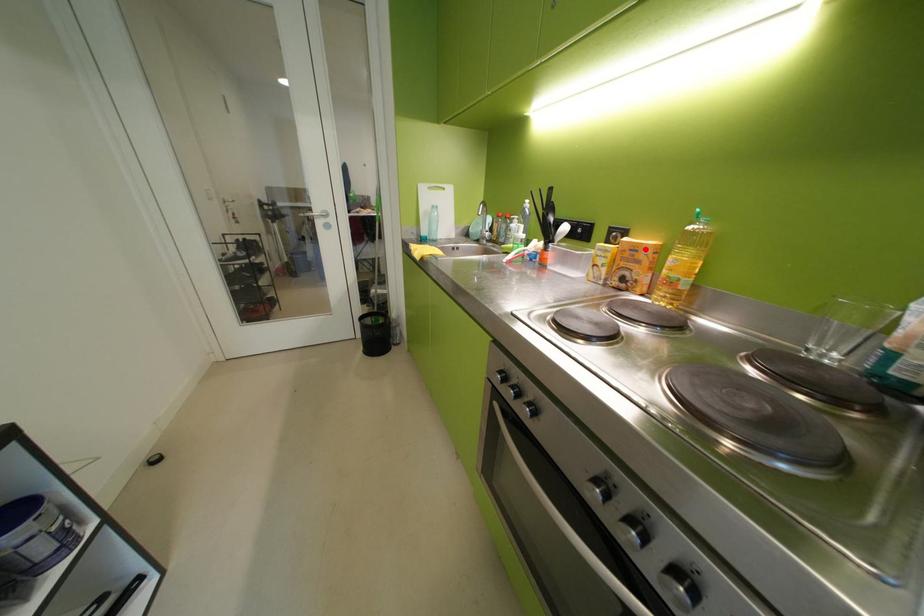
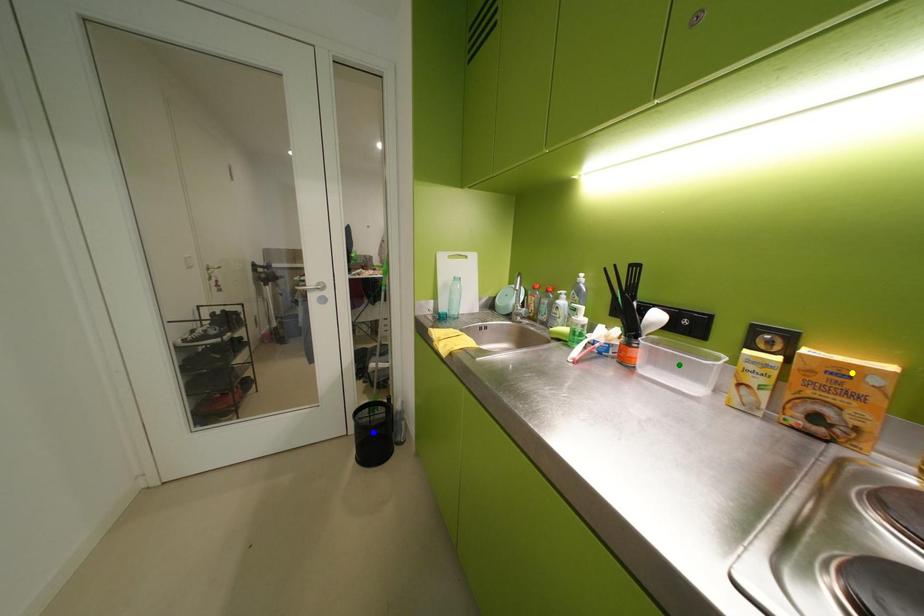
Question: I am providing you with two images of the same scene from different viewpoints. A red point is marked on the first image. You are given multiple points on the second image. Can you choose the point in image 2 that corresponds to the point in image 1?

Choices:
 (A) green point
 (B) blue point
 (C) yellow point

Answer: (C)